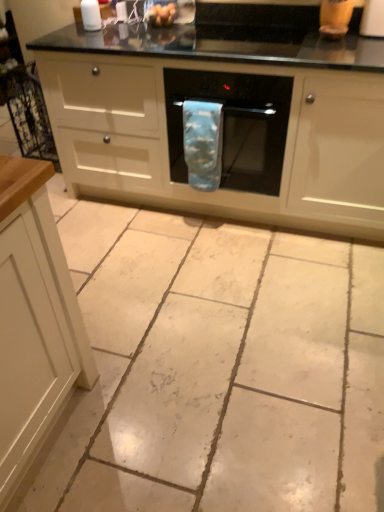
Question: Is blue fabric oven mitt at center positioned in front of blue fabric towel at center?

Choices:
 (A) no
 (B) yes

Answer: (B)

Question: From a real-world perspective, is blue fabric oven mitt at center over blue fabric towel at center?

Choices:
 (A) yes
 (B) no

Answer: (A)

Question: From the image's perspective, would you say blue fabric oven mitt at center is shown under blue fabric towel at center?

Choices:
 (A) yes
 (B) no

Answer: (B)

Question: Is blue fabric oven mitt at center wider than blue fabric towel at center?

Choices:
 (A) no
 (B) yes

Answer: (B)

Question: Is blue fabric oven mitt at center in contact with blue fabric towel at center?

Choices:
 (A) yes
 (B) no

Answer: (B)

Question: Can you confirm if blue fabric oven mitt at center is thinner than blue fabric towel at center?

Choices:
 (A) no
 (B) yes

Answer: (A)

Question: Is the surface of smooth plastic eggs at upper center in direct contact with white glossy salt shaker at upper left?

Choices:
 (A) no
 (B) yes

Answer: (A)

Question: Can you confirm if smooth plastic eggs at upper center is smaller than white glossy salt shaker at upper left?

Choices:
 (A) yes
 (B) no

Answer: (B)

Question: Is smooth plastic eggs at upper center positioned with its back to white glossy salt shaker at upper left?

Choices:
 (A) yes
 (B) no

Answer: (B)

Question: Can you confirm if smooth plastic eggs at upper center is wider than white glossy salt shaker at upper left?

Choices:
 (A) yes
 (B) no

Answer: (A)

Question: From a real-world perspective, is smooth plastic eggs at upper center beneath white glossy salt shaker at upper left?

Choices:
 (A) yes
 (B) no

Answer: (A)

Question: Can you confirm if smooth plastic eggs at upper center is bigger than white glossy salt shaker at upper left?

Choices:
 (A) no
 (B) yes

Answer: (B)

Question: From the image's perspective, is black glass oven at center under blue fabric oven mitt at center?

Choices:
 (A) yes
 (B) no

Answer: (A)